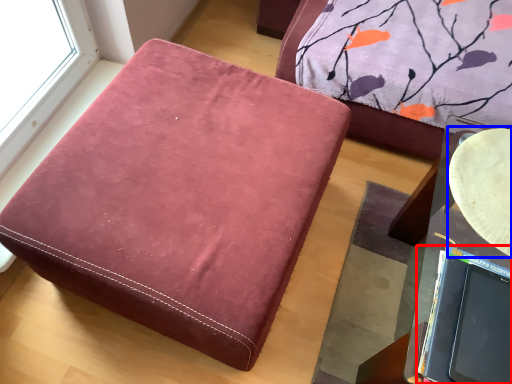
Question: Which object appears closest to the camera in this image, laptop (highlighted by a red box) or round table (highlighted by a blue box)?

Choices:
 (A) laptop
 (B) round table

Answer: (A)